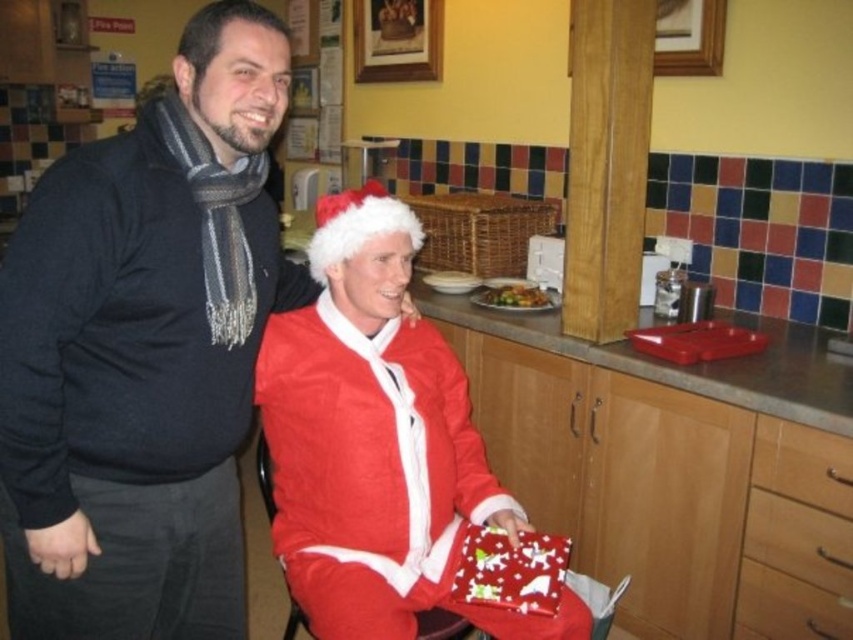
Question: Considering the real-world distances, which object is farthest from the golden brown crispy chicken at center?

Choices:
 (A) fuzzy red santa suit at center
 (B) shiny red wrapping paper at lower center
 (C) matte red santa suit at center

Answer: (C)

Question: Among these points, which one is nearest to the camera?

Choices:
 (A) (489, 556)
 (B) (21, 273)
 (C) (363, 403)

Answer: (B)

Question: Does fuzzy red santa suit at center appear under golden brown crispy chicken at center?

Choices:
 (A) yes
 (B) no

Answer: (A)

Question: Which point is closer to the camera taking this photo?

Choices:
 (A) (509, 292)
 (B) (90, 442)
 (C) (289, 448)

Answer: (B)

Question: Is shiny red wrapping paper at lower center above golden brown crispy chicken at center?

Choices:
 (A) yes
 (B) no

Answer: (B)

Question: Can you confirm if shiny red wrapping paper at lower center is positioned below golden brown crispy chicken at center?

Choices:
 (A) no
 (B) yes

Answer: (B)